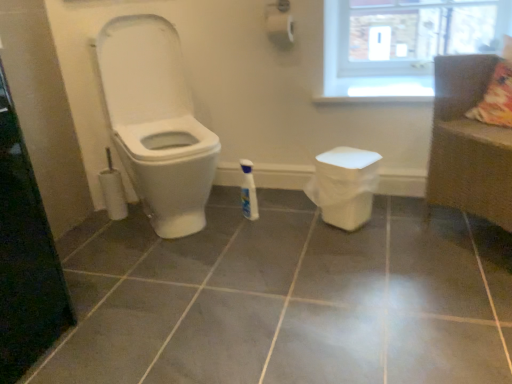
Question: From the image's perspective, does white glossy toilet at left appear lower than white glossy bottle at center?

Choices:
 (A) no
 (B) yes

Answer: (A)

Question: Does white glossy toilet at left have a greater width compared to white glossy bottle at center?

Choices:
 (A) yes
 (B) no

Answer: (A)

Question: Is white glossy toilet at left oriented towards white glossy bottle at center?

Choices:
 (A) yes
 (B) no

Answer: (B)

Question: Is white glossy toilet at left located outside white glossy bottle at center?

Choices:
 (A) yes
 (B) no

Answer: (A)

Question: From a real-world perspective, is white glossy toilet at left located higher than white glossy bottle at center?

Choices:
 (A) yes
 (B) no

Answer: (A)

Question: Considering the relative positions of white glossy toilet at left and white glossy bottle at center in the image provided, is white glossy toilet at left in front of white glossy bottle at center?

Choices:
 (A) yes
 (B) no

Answer: (A)

Question: Is transparent glass screen door at left closer to the viewer compared to white glossy bottle at center?

Choices:
 (A) yes
 (B) no

Answer: (A)

Question: Can you confirm if transparent glass screen door at left is shorter than white glossy bottle at center?

Choices:
 (A) yes
 (B) no

Answer: (B)

Question: Is transparent glass screen door at left outside white glossy bottle at center?

Choices:
 (A) yes
 (B) no

Answer: (A)

Question: From a real-world perspective, is transparent glass screen door at left positioned under white glossy bottle at center based on gravity?

Choices:
 (A) no
 (B) yes

Answer: (A)

Question: From a real-world perspective, does transparent glass screen door at left stand above white glossy bottle at center?

Choices:
 (A) no
 (B) yes

Answer: (B)

Question: Does transparent glass screen door at left have a smaller size compared to white glossy bottle at center?

Choices:
 (A) no
 (B) yes

Answer: (A)

Question: Can you confirm if white glossy bottle at center is taller than white glossy toilet at left?

Choices:
 (A) no
 (B) yes

Answer: (A)